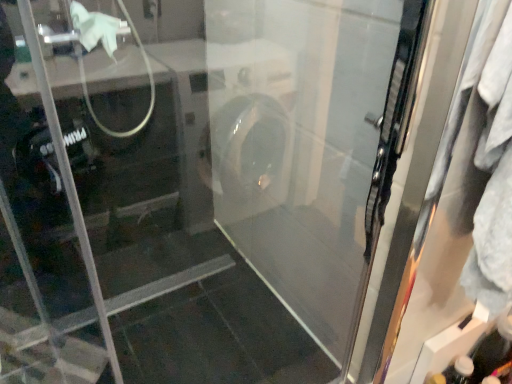
Question: Considering the positions of transparent plastic bottle at lower right and clear glass screen door at right in the image, is transparent plastic bottle at lower right taller or shorter than clear glass screen door at right?

Choices:
 (A) tall
 (B) short

Answer: (B)

Question: From the image's perspective, is transparent plastic bottle at lower right positioned above or below clear glass screen door at right?

Choices:
 (A) below
 (B) above

Answer: (A)

Question: Would you say transparent plastic bottle at lower right is to the left or to the right of clear glass screen door at right in the picture?

Choices:
 (A) left
 (B) right

Answer: (B)

Question: Considering the positions of point (406, 367) and point (502, 364), is point (406, 367) closer or farther from the camera than point (502, 364)?

Choices:
 (A) closer
 (B) farther

Answer: (A)

Question: From a real-world perspective, relative to transparent plastic bottle at lower right, is clear glass screen door at right vertically above or below?

Choices:
 (A) above
 (B) below

Answer: (A)

Question: Is clear glass screen door at right taller or shorter than transparent plastic bottle at lower right?

Choices:
 (A) short
 (B) tall

Answer: (B)

Question: Considering the positions of clear glass screen door at right and transparent plastic bottle at lower right in the image, is clear glass screen door at right wider or thinner than transparent plastic bottle at lower right?

Choices:
 (A) thin
 (B) wide

Answer: (B)